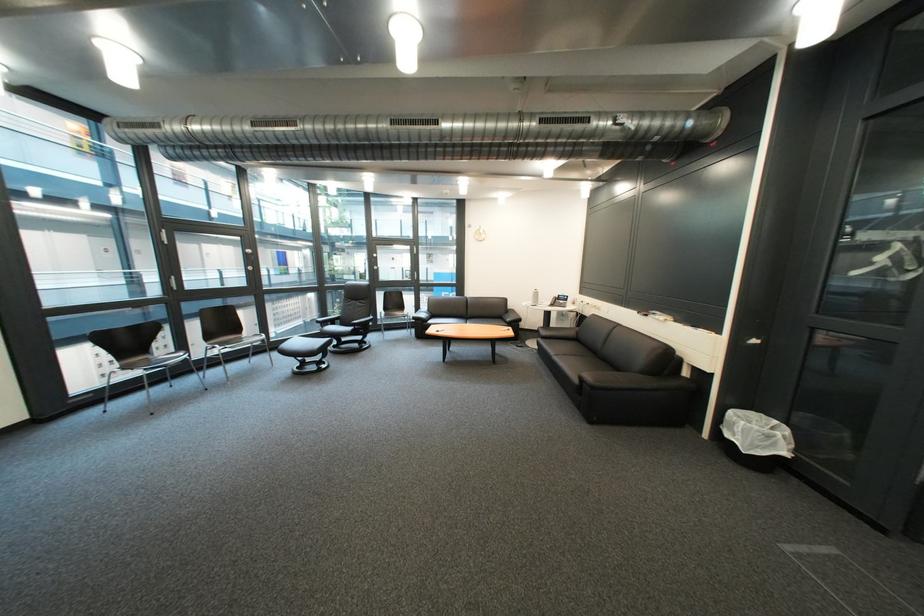
Find where to lift the telephone handset. Please return your answer as a coordinate pair (x, y).

(558, 301)